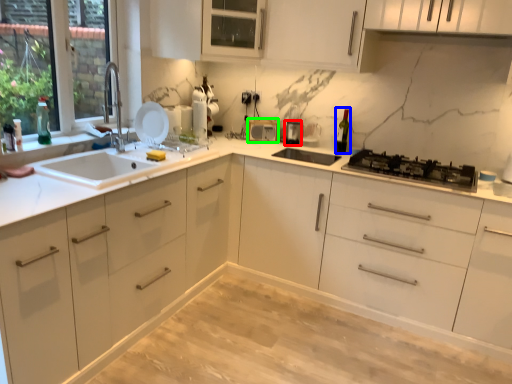
Question: Based on their relative distances, which object is nearer to appliance (highlighted by a red box)? Choose from wine bottle (highlighted by a blue box) and appliance (highlighted by a green box).

Choices:
 (A) wine bottle
 (B) appliance

Answer: (B)